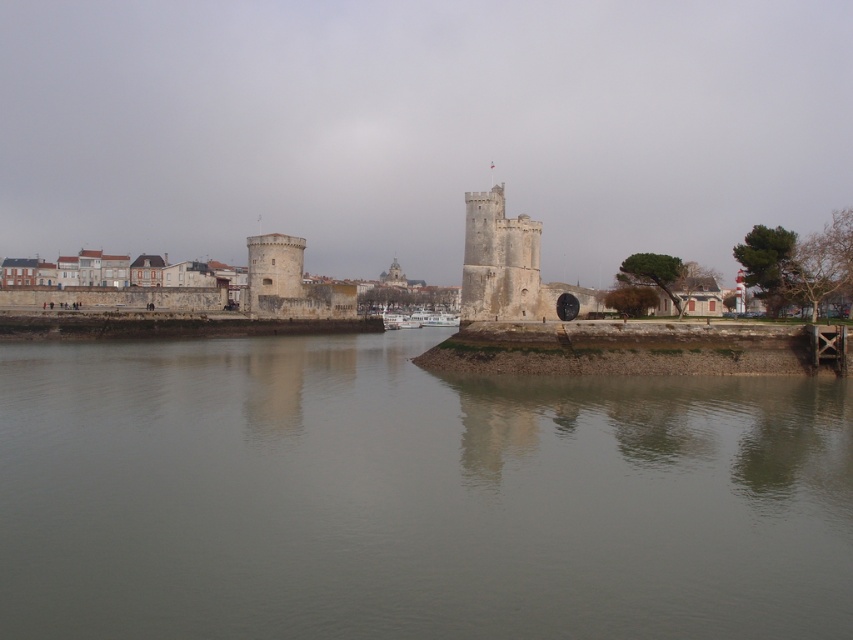
Question: Is gray concrete river at center behind stone tower at center?

Choices:
 (A) yes
 (B) no

Answer: (B)

Question: Which object is closer to the camera taking this photo?

Choices:
 (A) stone tower at center
 (B) gray concrete river at center

Answer: (B)

Question: Is gray concrete river at center in front of stone tower at center?

Choices:
 (A) no
 (B) yes

Answer: (B)

Question: Where is gray concrete river at center located in relation to stone tower at center in the image?

Choices:
 (A) above
 (B) below

Answer: (B)

Question: Which point appears closest to the camera in this image?

Choices:
 (A) (4, 541)
 (B) (473, 252)

Answer: (A)